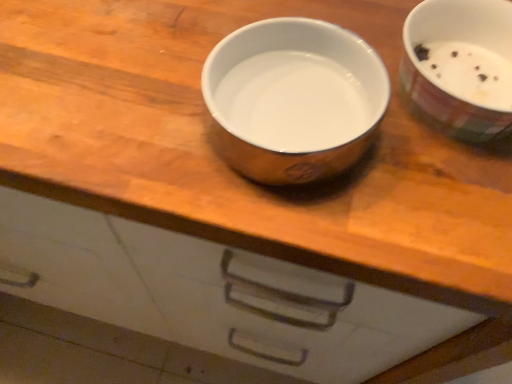
I want to click on white glossy bowl at upper right, which appears as the first tableware when viewed from the right, so click(463, 41).

What do you see at coordinates (463, 41) in the screenshot? I see `white glossy bowl at upper right, which appears as the first tableware when viewed from the right` at bounding box center [463, 41].

Describe the element at coordinates (294, 99) in the screenshot. I see `satin silver bowl at center, which is the 2th tableware in right-to-left order` at that location.

What is the approximate height of satin silver bowl at center, marked as the 1th tableware in a left-to-right arrangement?

satin silver bowl at center, marked as the 1th tableware in a left-to-right arrangement, is 6.07 centimeters in height.

Locate an element on the screen. satin silver bowl at center, marked as the 1th tableware in a left-to-right arrangement is located at coordinates (294, 99).

Locate an element on the screen. white glossy bowl at upper right, the 2th tableware from the left is located at coordinates (463, 41).

Can you confirm if satin silver bowl at center, which is the 2th tableware in right-to-left order, is positioned to the right of white glossy bowl at upper right, the 2th tableware from the left?

In fact, satin silver bowl at center, which is the 2th tableware in right-to-left order, is to the left of white glossy bowl at upper right, the 2th tableware from the left.

Which object is closer to the camera taking this photo, satin silver bowl at center, marked as the 1th tableware in a left-to-right arrangement, or white glossy bowl at upper right, which appears as the first tableware when viewed from the right?

satin silver bowl at center, marked as the 1th tableware in a left-to-right arrangement.

Which is farther from the camera, (233, 158) or (485, 109)?

The point (233, 158) is behind.

From the image's perspective, is satin silver bowl at center, which is the 2th tableware in right-to-left order, located beneath white glossy bowl at upper right, the 2th tableware from the left?

Correct, satin silver bowl at center, which is the 2th tableware in right-to-left order, appears lower than white glossy bowl at upper right, the 2th tableware from the left, in the image.

From a real-world perspective, which is physically above, satin silver bowl at center, marked as the 1th tableware in a left-to-right arrangement, or white glossy bowl at upper right, the 2th tableware from the left?

A: From a 3D spatial view, white glossy bowl at upper right, the 2th tableware from the left, is above.

Based on the photo, is satin silver bowl at center, marked as the 1th tableware in a left-to-right arrangement, wider or thinner than white glossy bowl at upper right, the 2th tableware from the left?

satin silver bowl at center, marked as the 1th tableware in a left-to-right arrangement, is thinner than white glossy bowl at upper right, the 2th tableware from the left.

Considering the relative sizes of satin silver bowl at center, which is the 2th tableware in right-to-left order, and white glossy bowl at upper right, which appears as the first tableware when viewed from the right, in the image provided, is satin silver bowl at center, which is the 2th tableware in right-to-left order, taller than white glossy bowl at upper right, which appears as the first tableware when viewed from the right,?

No, satin silver bowl at center, which is the 2th tableware in right-to-left order, is not taller than white glossy bowl at upper right, which appears as the first tableware when viewed from the right.

Can you confirm if satin silver bowl at center, marked as the 1th tableware in a left-to-right arrangement, is bigger than white glossy bowl at upper right, which appears as the first tableware when viewed from the right?

No.

Is white glossy bowl at upper right, which appears as the first tableware when viewed from the right, surrounded by satin silver bowl at center, marked as the 1th tableware in a left-to-right arrangement?

That's incorrect, white glossy bowl at upper right, which appears as the first tableware when viewed from the right, is not inside satin silver bowl at center, marked as the 1th tableware in a left-to-right arrangement.

From the picture: Are satin silver bowl at center, marked as the 1th tableware in a left-to-right arrangement, and white glossy bowl at upper right, the 2th tableware from the left, beside each other?

satin silver bowl at center, marked as the 1th tableware in a left-to-right arrangement, and white glossy bowl at upper right, the 2th tableware from the left, are clearly separated.

Is satin silver bowl at center, which is the 2th tableware in right-to-left order, looking in the opposite direction of white glossy bowl at upper right, the 2th tableware from the left?

satin silver bowl at center, which is the 2th tableware in right-to-left order, does not have its back to white glossy bowl at upper right, the 2th tableware from the left.

How different are the orientations of satin silver bowl at center, marked as the 1th tableware in a left-to-right arrangement, and white glossy bowl at upper right, which appears as the first tableware when viewed from the right, in degrees?

They differ by 1.12 degrees in their facing directions.

Where is `tableware located in front of the white glossy bowl at upper right, the 2th tableware from the left`? This screenshot has width=512, height=384. tableware located in front of the white glossy bowl at upper right, the 2th tableware from the left is located at coordinates (294, 99).

Visually, is white glossy bowl at upper right, the 2th tableware from the left, positioned to the left or to the right of satin silver bowl at center, which is the 2th tableware in right-to-left order?

white glossy bowl at upper right, the 2th tableware from the left, is positioned on satin silver bowl at center, which is the 2th tableware in right-to-left order,'s right side.

Which is in front, white glossy bowl at upper right, the 2th tableware from the left, or satin silver bowl at center, which is the 2th tableware in right-to-left order?

satin silver bowl at center, which is the 2th tableware in right-to-left order, is closer to the camera.

Does point (433, 38) come in front of point (309, 124)?

No, it is behind (309, 124).

From the image's perspective, which is below, white glossy bowl at upper right, which appears as the first tableware when viewed from the right, or satin silver bowl at center, which is the 2th tableware in right-to-left order?

satin silver bowl at center, which is the 2th tableware in right-to-left order, appears lower in the image.

From a real-world perspective, which object rests below the other?

In real-world perspective, satin silver bowl at center, marked as the 1th tableware in a left-to-right arrangement, is lower.

Can you confirm if white glossy bowl at upper right, which appears as the first tableware when viewed from the right, is wider than satin silver bowl at center, which is the 2th tableware in right-to-left order?

Yes, white glossy bowl at upper right, which appears as the first tableware when viewed from the right, is wider than satin silver bowl at center, which is the 2th tableware in right-to-left order.

In terms of height, does white glossy bowl at upper right, which appears as the first tableware when viewed from the right, look taller or shorter compared to satin silver bowl at center, which is the 2th tableware in right-to-left order?

In the image, white glossy bowl at upper right, which appears as the first tableware when viewed from the right, appears to be taller than satin silver bowl at center, which is the 2th tableware in right-to-left order.

In terms of size, does white glossy bowl at upper right, which appears as the first tableware when viewed from the right, appear bigger or smaller than satin silver bowl at center, marked as the 1th tableware in a left-to-right arrangement?

In the image, white glossy bowl at upper right, which appears as the first tableware when viewed from the right, appears to be larger than satin silver bowl at center, marked as the 1th tableware in a left-to-right arrangement.

Would you say satin silver bowl at center, which is the 2th tableware in right-to-left order, is part of white glossy bowl at upper right, the 2th tableware from the left,'s contents?

Definitely not — satin silver bowl at center, which is the 2th tableware in right-to-left order, is not inside white glossy bowl at upper right, the 2th tableware from the left.

Is white glossy bowl at upper right, the 2th tableware from the left, far away from satin silver bowl at center, marked as the 1th tableware in a left-to-right arrangement?

No, white glossy bowl at upper right, the 2th tableware from the left, is not far away from satin silver bowl at center, marked as the 1th tableware in a left-to-right arrangement.

Does white glossy bowl at upper right, which appears as the first tableware when viewed from the right, turn towards satin silver bowl at center, which is the 2th tableware in right-to-left order?

No.

Measure the distance between white glossy bowl at upper right, which appears as the first tableware when viewed from the right, and satin silver bowl at center, marked as the 1th tableware in a left-to-right arrangement.

They are 4.28 inches apart.

This screenshot has height=384, width=512. Find the location of `tableware that is below the white glossy bowl at upper right, which appears as the first tableware when viewed from the right (from the image's perspective)`. tableware that is below the white glossy bowl at upper right, which appears as the first tableware when viewed from the right (from the image's perspective) is located at coordinates (294, 99).

I want to click on tableware in front of the white glossy bowl at upper right, which appears as the first tableware when viewed from the right, so click(294, 99).

Identify the location of tableware on the left side of white glossy bowl at upper right, the 2th tableware from the left. The height and width of the screenshot is (384, 512). (294, 99).